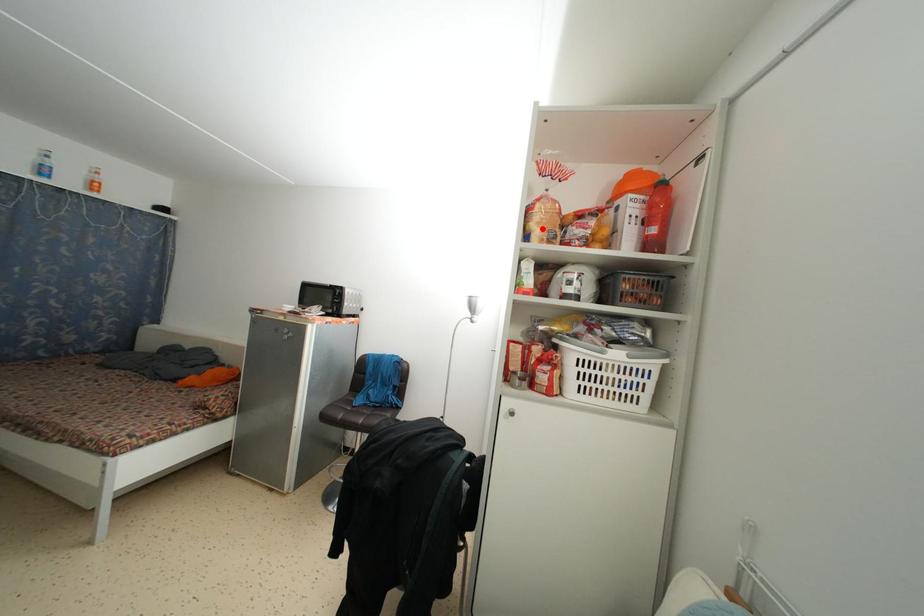
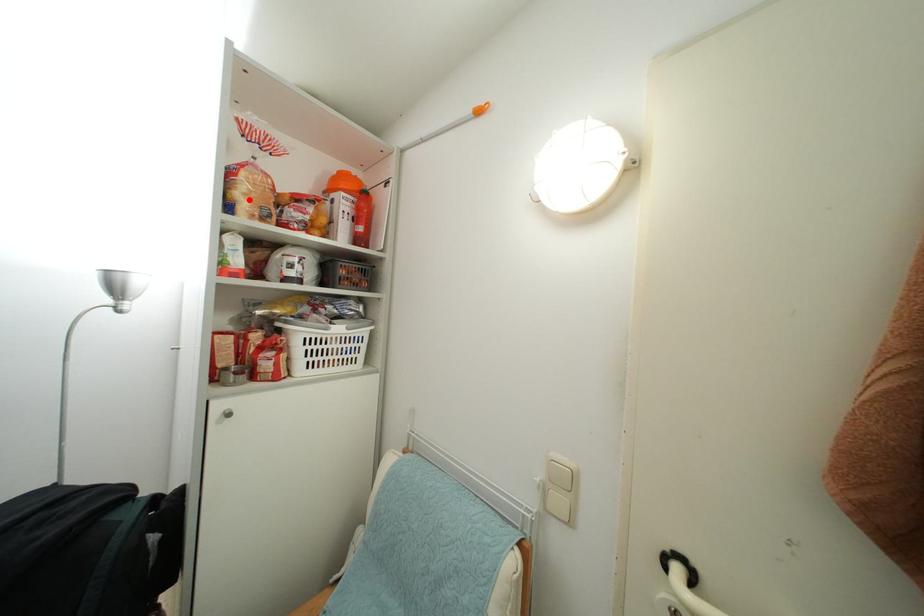
I am providing you with two images of the same scene from different viewpoints. A red point is marked on the first image and another point is marked on the second image. Are the points marked in image1 and image2 representing the same 3D position?

Yes